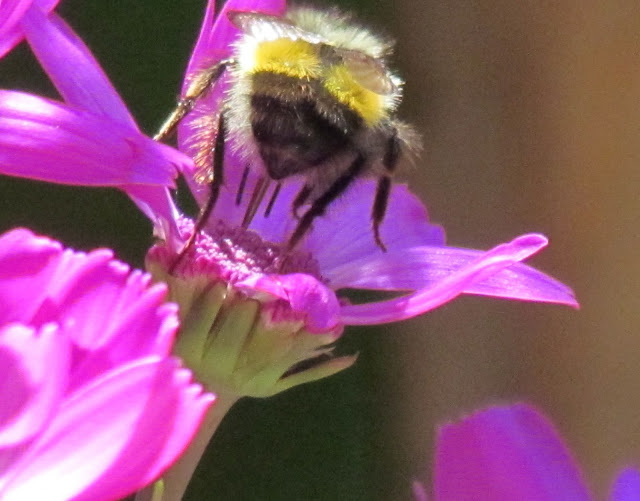
You are a GUI agent. You are given a task and a screenshot of the screen. Output one action in this format:
    pyautogui.click(x=<x>, y=<y>)
    Task: Click on the receptacle
    The width and height of the screenshot is (640, 501).
    Given the screenshot: What is the action you would take?
    pyautogui.click(x=225, y=354)